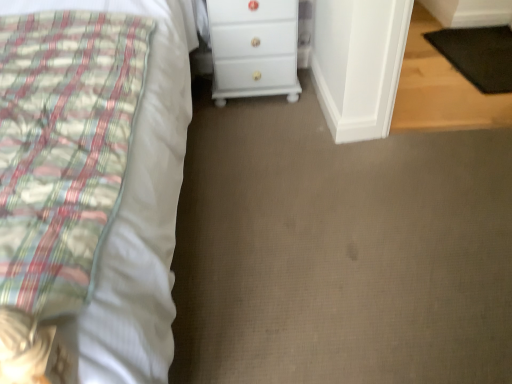
Question: Considering the relative positions of white glossy chest of drawers at center and black rubber mat at lower right in the image provided, is white glossy chest of drawers at center to the left of black rubber mat at lower right from the viewer's perspective?

Choices:
 (A) no
 (B) yes

Answer: (B)

Question: Can we say white glossy chest of drawers at center lies outside black rubber mat at lower right?

Choices:
 (A) yes
 (B) no

Answer: (A)

Question: Is white glossy chest of drawers at center next to black rubber mat at lower right and touching it?

Choices:
 (A) no
 (B) yes

Answer: (A)

Question: Can you confirm if white glossy chest of drawers at center is taller than black rubber mat at lower right?

Choices:
 (A) no
 (B) yes

Answer: (B)

Question: Could you tell me if white glossy chest of drawers at center is turned towards black rubber mat at lower right?

Choices:
 (A) yes
 (B) no

Answer: (B)

Question: Can you confirm if white glossy chest of drawers at center is positioned to the right of black rubber mat at lower right?

Choices:
 (A) no
 (B) yes

Answer: (A)

Question: Is white cotton bed at left bigger than white glossy chest of drawers at center?

Choices:
 (A) yes
 (B) no

Answer: (A)

Question: Is there a large distance between white cotton bed at left and white glossy chest of drawers at center?

Choices:
 (A) yes
 (B) no

Answer: (B)

Question: Would you say white glossy chest of drawers at center is part of white cotton bed at left's contents?

Choices:
 (A) no
 (B) yes

Answer: (A)

Question: Does white cotton bed at left appear on the right side of white glossy chest of drawers at center?

Choices:
 (A) yes
 (B) no

Answer: (B)

Question: Considering the relative sizes of white cotton bed at left and white glossy chest of drawers at center in the image provided, is white cotton bed at left smaller than white glossy chest of drawers at center?

Choices:
 (A) no
 (B) yes

Answer: (A)

Question: Is white cotton bed at left next to white glossy chest of drawers at center and touching it?

Choices:
 (A) no
 (B) yes

Answer: (A)

Question: Is black rubber mat at lower right positioned far away from white glossy chest of drawers at center?

Choices:
 (A) yes
 (B) no

Answer: (A)